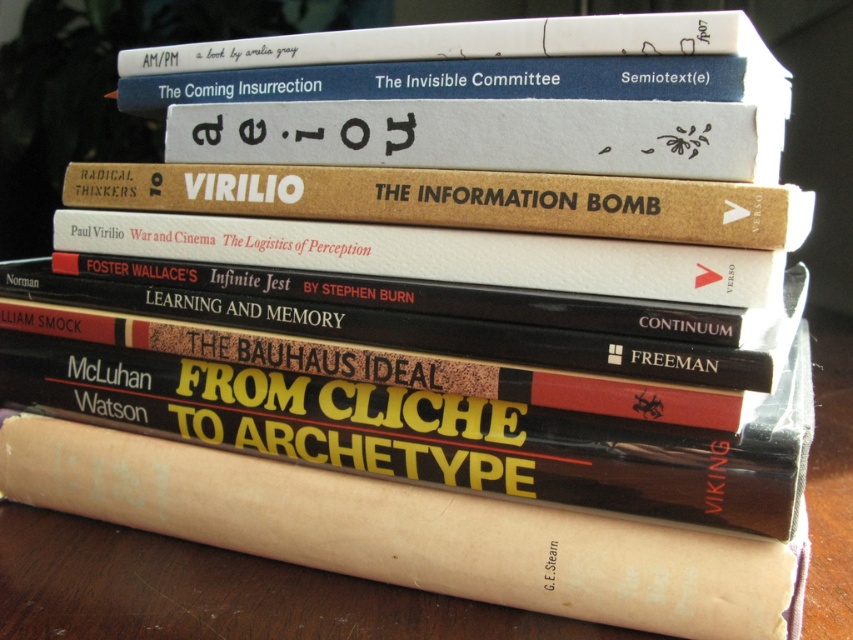
You are organizing a bookshelf and have two books in front of you on the wooden surface. The brown paper book at center and the brown cardboard book at center. Which book is taller?

The brown paper book at center is taller than the brown cardboard book at center according to the description.

What is located at the coordinates point (412, 532)?

A brown paper book at center is located at point (412, 532).

You are organizing books on a shelf and need to place the brown paper book at center and the brown cardboard book at center. The shelf you have is only 20 centimeters wide. Can both books fit side by side on this shelf without overlapping?

The distance between the brown paper book at center and the brown cardboard book at center is 23.15 centimeters. Since the shelf is only 20 centimeters wide, the two books cannot fit side by side without overlapping.